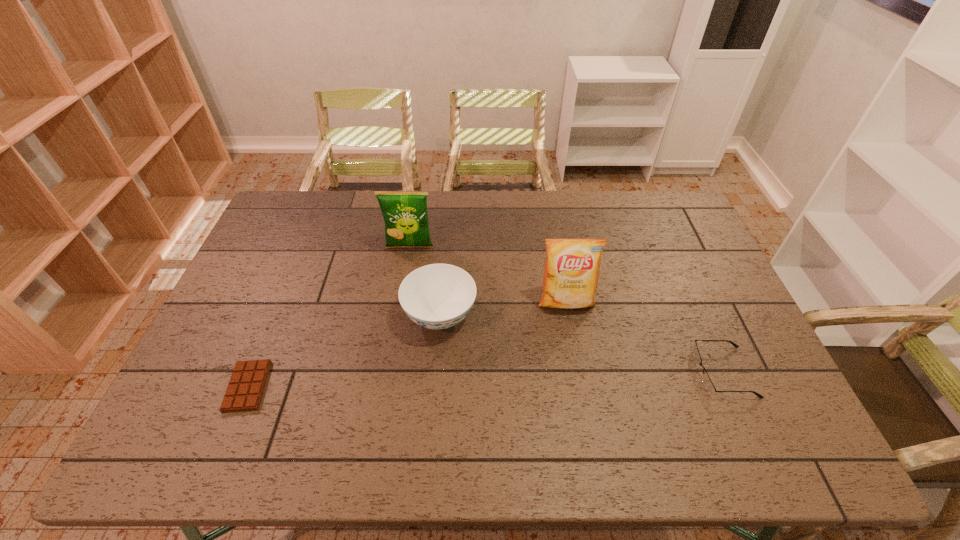
In order to click on blank space located 0.090m on the front-facing side of the farthest object in this screenshot , I will do `click(405, 273)`.

Where is `vacant space located on the left of the chinaware`? The height and width of the screenshot is (540, 960). vacant space located on the left of the chinaware is located at coordinates (297, 316).

Where is `vacant space located on the front-facing side of the spectacles`? This screenshot has height=540, width=960. vacant space located on the front-facing side of the spectacles is located at coordinates (563, 372).

The height and width of the screenshot is (540, 960). I want to click on vacant space located 0.240m on the front-facing side of the spectacles, so click(x=605, y=372).

Where is `vacant region located on the front-facing side of the spectacles`? Image resolution: width=960 pixels, height=540 pixels. vacant region located on the front-facing side of the spectacles is located at coordinates (666, 372).

Locate an element on the screen. free space located on the right of the candy bar is located at coordinates (319, 387).

Find the location of a particular element. The image size is (960, 540). object situated at the left edge is located at coordinates (247, 383).

Identify the location of object situated at the right edge. Image resolution: width=960 pixels, height=540 pixels. (707, 382).

Identify the location of free spot at the far edge of the desktop. This screenshot has width=960, height=540. (514, 221).

Where is `vacant space at the near edge`? vacant space at the near edge is located at coordinates (587, 454).